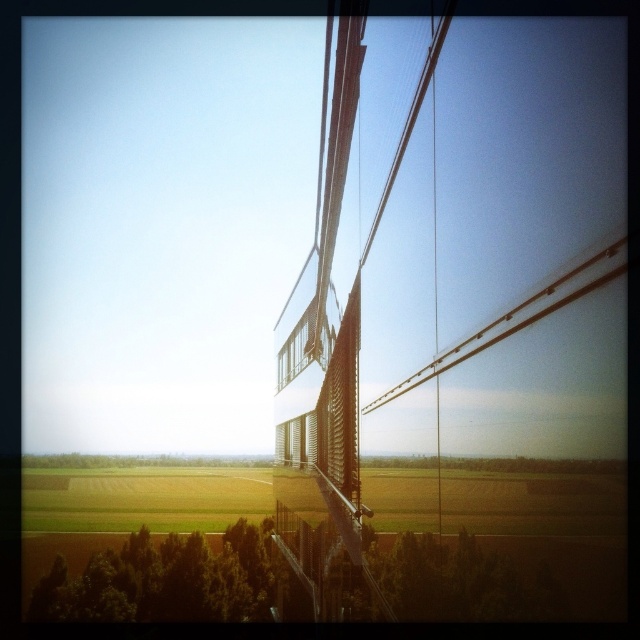
You are standing in the field looking at the green leafy tree at lower left and the clear glass window at center. Which object appears taller in the scene?

The green leafy tree at lower left appears taller than the clear glass window at center in the scene.

You are standing in the field looking at the green leafy tree at lower left and the clear glass window at center. Which object appears bigger to you?

The green leafy tree at lower left appears bigger than the clear glass window at center because it has a larger size compared to the clear glass window at center.